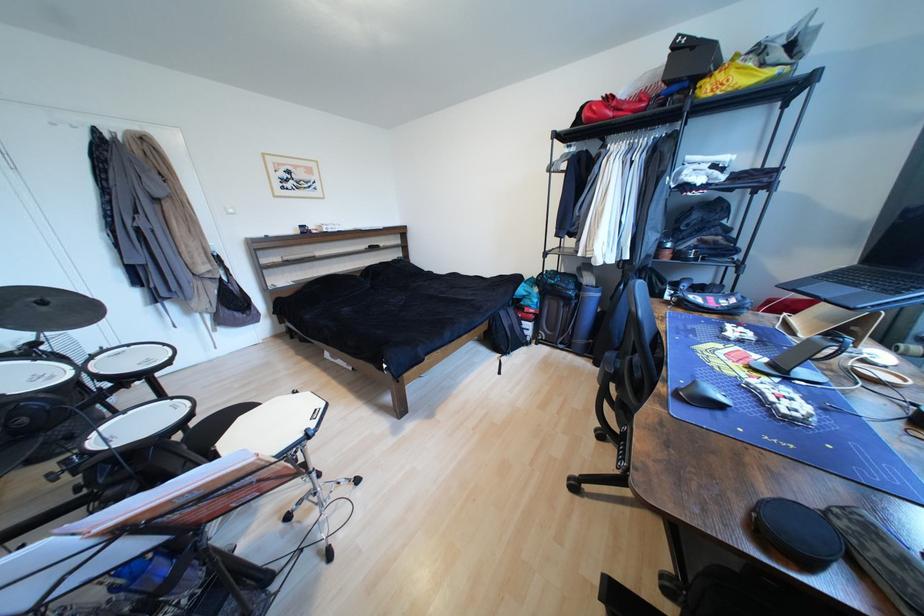
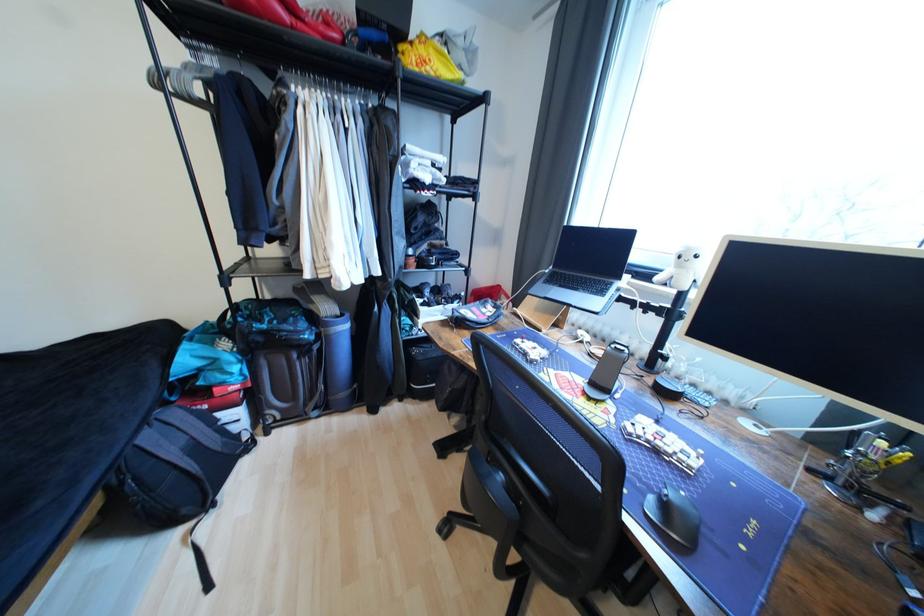
The point at (706, 84) is marked in the first image. Where is the corresponding point in the second image?

(407, 49)